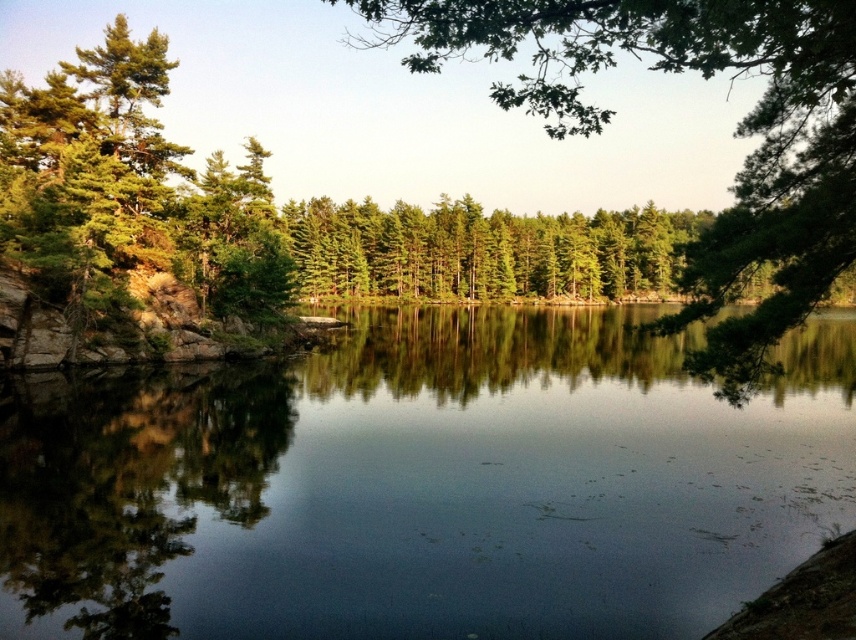
Can you confirm if green matte tree at upper center is shorter than green matte trees at center?

No, green matte tree at upper center is not shorter than green matte trees at center.

Which is more to the left, green matte tree at upper center or green matte trees at center?

From the viewer's perspective, green matte trees at center appears more on the left side.

Describe the element at coordinates (734, 132) in the screenshot. The height and width of the screenshot is (640, 856). I see `green matte tree at upper center` at that location.

Where is `green matte tree at upper center`? This screenshot has width=856, height=640. green matte tree at upper center is located at coordinates (734, 132).

Which is behind, point (177, 435) or point (724, 227)?

The point (177, 435) is more distant.

Is clear water at center in front of green matte tree at upper center?

No, clear water at center is further to the viewer.

Locate an element on the screen. Image resolution: width=856 pixels, height=640 pixels. clear water at center is located at coordinates (424, 484).

Who is higher up, clear water at center or green matte trees at center?

green matte trees at center is above.

Is clear water at center bigger than green matte trees at center?

No.

What do you see at coordinates (424, 484) in the screenshot?
I see `clear water at center` at bounding box center [424, 484].

Locate an element on the screen. This screenshot has width=856, height=640. clear water at center is located at coordinates (424, 484).